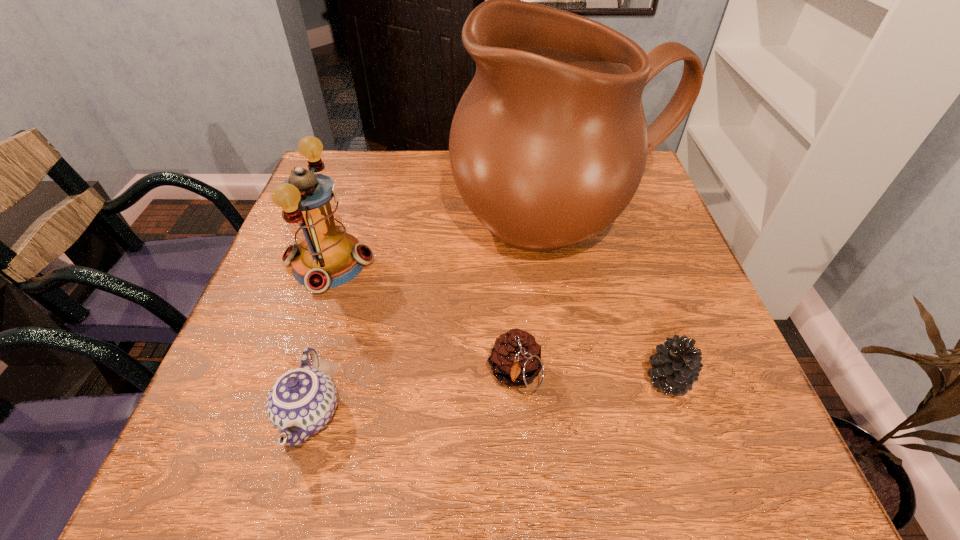
Locate an element on the screen. object that is at the near edge is located at coordinates (302, 401).

This screenshot has height=540, width=960. In order to click on lantern that is at the left edge in this screenshot , I will do `click(325, 256)`.

The height and width of the screenshot is (540, 960). Find the location of `chinaware that is at the left edge`. chinaware that is at the left edge is located at coordinates (302, 401).

The width and height of the screenshot is (960, 540). I want to click on cream pitcher present at the right edge, so click(548, 145).

The image size is (960, 540). I want to click on pinecone that is at the right edge, so click(675, 367).

At what (x,y) coordinates should I click in order to perform the action: click on object that is positioned at the near left corner. Please return your answer as a coordinate pair (x, y). Looking at the image, I should click on (302, 401).

The height and width of the screenshot is (540, 960). In order to click on object that is at the far right corner in this screenshot , I will do `click(548, 145)`.

You are a GUI agent. You are given a task and a screenshot of the screen. Output one action in this format:
    pyautogui.click(x=<x>, y=<y>)
    Task: Click on the vacant space at the far edge of the desktop
    Image resolution: width=960 pixels, height=540 pixels.
    Given the screenshot: What is the action you would take?
    pyautogui.click(x=378, y=193)

Where is `free space at the near edge`? Image resolution: width=960 pixels, height=540 pixels. free space at the near edge is located at coordinates (326, 463).

At what (x,y) coordinates should I click in order to perform the action: click on vacant space at the left edge. Please return your answer as a coordinate pair (x, y). This screenshot has width=960, height=540. Looking at the image, I should click on (288, 267).